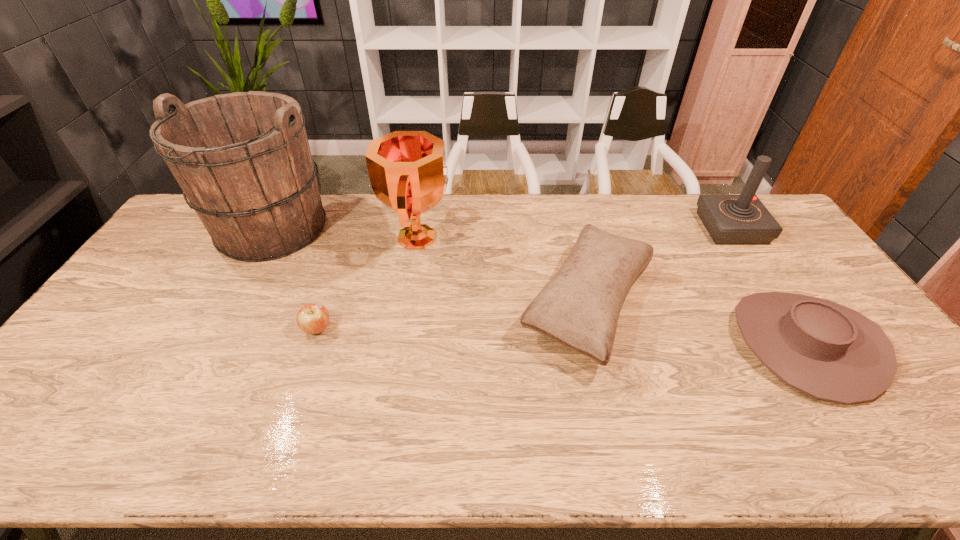
I want to click on object that is the closest to the tallest object, so click(x=313, y=318).

Identify the location of the closest object to the fifth tallest object. coord(579,308).

Where is `vacant space that satisfies the following two spatial constraints: 1. on the side of the fifth tallest object with the star emblem; 2. on the right side of the award`? This screenshot has width=960, height=540. vacant space that satisfies the following two spatial constraints: 1. on the side of the fifth tallest object with the star emblem; 2. on the right side of the award is located at coordinates (401, 344).

Find the location of a particular element. Image resolution: width=960 pixels, height=540 pixels. free spot that satisfies the following two spatial constraints: 1. on the side of the award with the star emblem; 2. on the back side of the cowboy hat is located at coordinates (401, 344).

Identify the location of blank space that satisfies the following two spatial constraints: 1. on the front side of the second object from left to right; 2. on the left side of the second shortest object. This screenshot has width=960, height=540. (312, 344).

Locate an element on the screen. The width and height of the screenshot is (960, 540). free space in the image that satisfies the following two spatial constraints: 1. on the rectangular base of the fourth shortest object; 2. on the front side of the cushion is located at coordinates (782, 305).